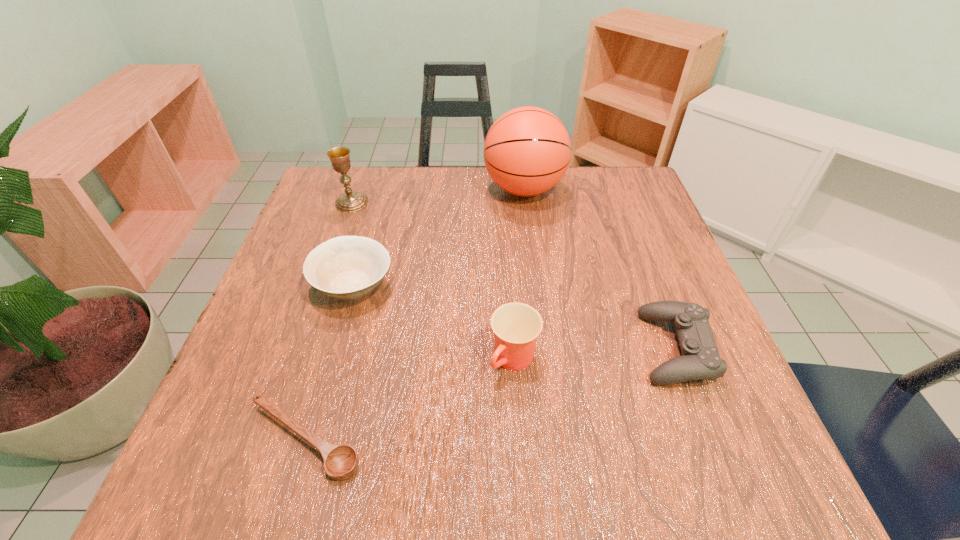
This screenshot has width=960, height=540. In order to click on vacant region located 0.150m on the front of the third tallest object in this screenshot , I will do `click(521, 478)`.

The image size is (960, 540). Identify the location of vacant space located 0.160m on the front of the bowl. (324, 391).

This screenshot has width=960, height=540. I want to click on vacant space located 0.290m on the back of the control, so click(626, 220).

Locate an element on the screen. This screenshot has width=960, height=540. free space located on the back of the shortest object is located at coordinates (353, 274).

Image resolution: width=960 pixels, height=540 pixels. In order to click on basketball present at the far edge in this screenshot , I will do `click(527, 151)`.

Where is `chalice present at the far edge`? The height and width of the screenshot is (540, 960). chalice present at the far edge is located at coordinates (350, 202).

Locate an element on the screen. This screenshot has width=960, height=540. object present at the near edge is located at coordinates (341, 462).

Where is `chalice that is positioned at the left edge`? The height and width of the screenshot is (540, 960). chalice that is positioned at the left edge is located at coordinates (350, 202).

Identify the location of bowl situated at the left edge. Image resolution: width=960 pixels, height=540 pixels. (346, 267).

What are the coordinates of `wooden spoon located in the left edge section of the desktop` in the screenshot? It's located at (341, 462).